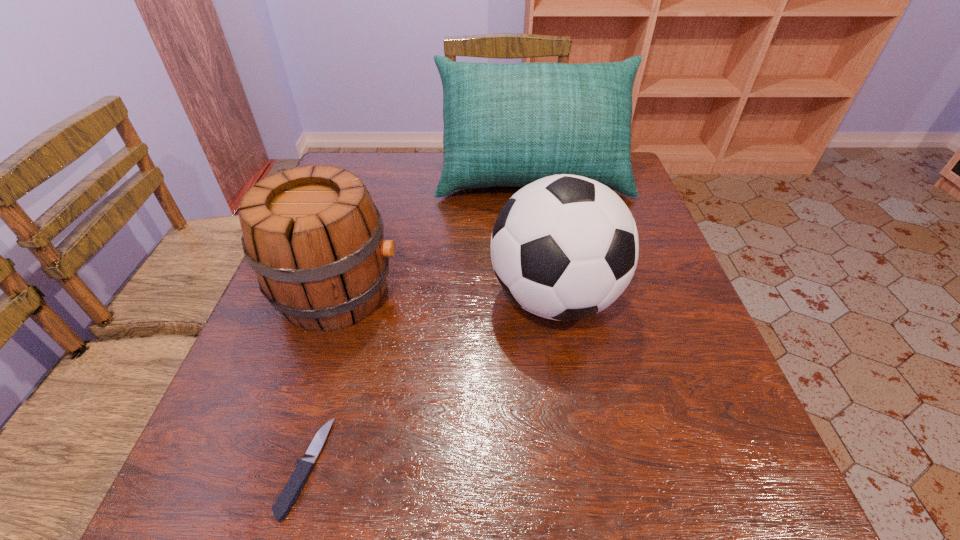
Image resolution: width=960 pixels, height=540 pixels. In order to click on object that is at the near edge in this screenshot , I will do `click(293, 488)`.

Find the location of a particular element. This screenshot has height=540, width=960. cider present at the left edge is located at coordinates (313, 236).

Find the location of a particular element. The image size is (960, 540). steak knife at the left edge is located at coordinates (293, 488).

In order to click on cushion that is at the right edge in this screenshot , I will do `click(509, 125)`.

Where is `soccer ball located in the right edge section of the desktop`? The width and height of the screenshot is (960, 540). soccer ball located in the right edge section of the desktop is located at coordinates (564, 247).

This screenshot has width=960, height=540. I want to click on object at the near left corner, so click(293, 488).

The height and width of the screenshot is (540, 960). Find the location of `object that is at the far right corner`. object that is at the far right corner is located at coordinates (509, 125).

You are a GUI agent. You are given a task and a screenshot of the screen. Output one action in this format:
    pyautogui.click(x=<x>, y=<y>)
    Task: Click on the vacant space at the near edge
    This screenshot has height=540, width=960.
    Given the screenshot: What is the action you would take?
    pyautogui.click(x=328, y=524)

The width and height of the screenshot is (960, 540). I want to click on vacant space at the left edge of the desktop, so click(294, 406).

The image size is (960, 540). Find the location of `vacant space at the right edge of the desktop`. vacant space at the right edge of the desktop is located at coordinates (641, 298).